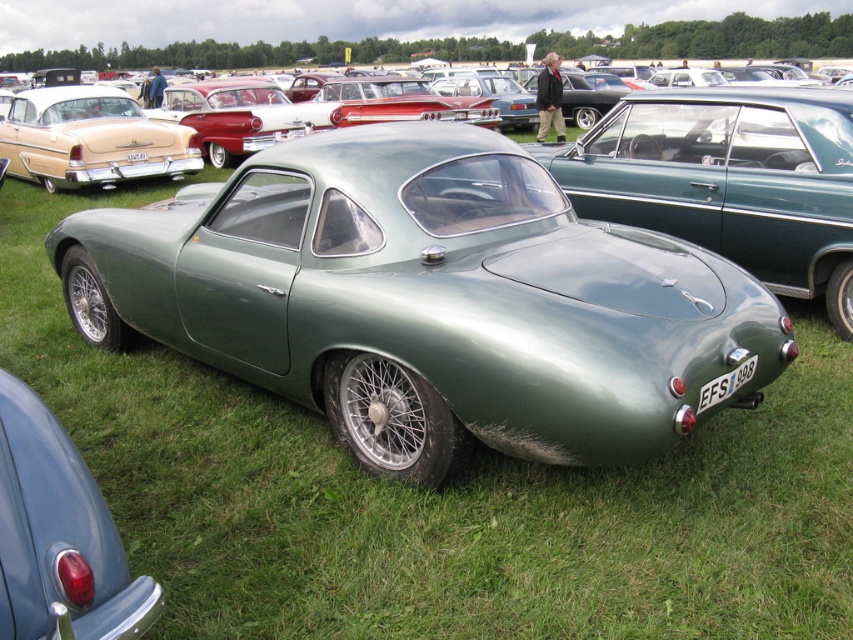
Is metallic green car at center positioned in front of matte red taillight at lower left?

No, it is behind matte red taillight at lower left.

Which is in front, point (204, 122) or point (80, 616)?

Point (80, 616)

The height and width of the screenshot is (640, 853). Find the location of `metallic green car at center`. metallic green car at center is located at coordinates (239, 109).